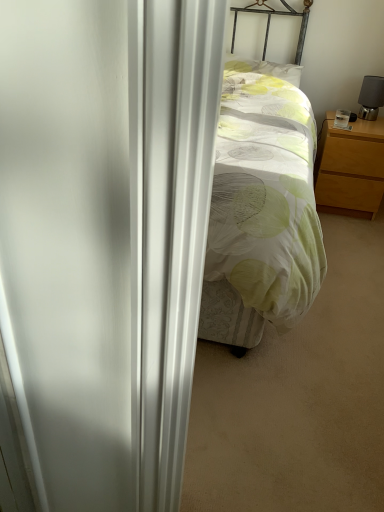
Where is `vacant space situated on the left part of black matte table lamp at right`? The height and width of the screenshot is (512, 384). vacant space situated on the left part of black matte table lamp at right is located at coordinates (347, 113).